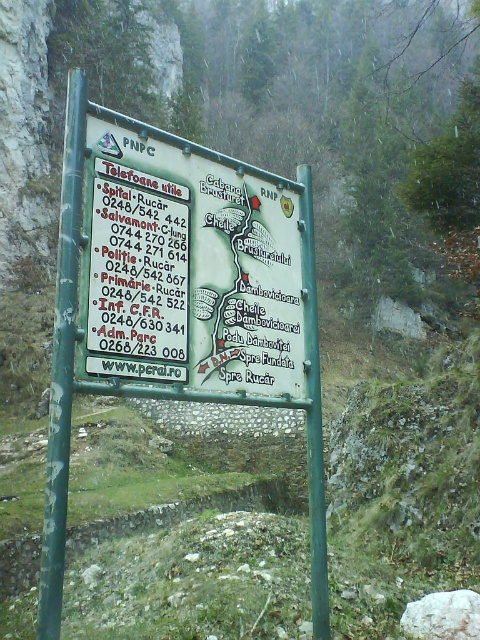
Between green metal sign at center and green painted metal pole at left, which one is positioned higher?

green metal sign at center is above.

Locate an element on the screen. The width and height of the screenshot is (480, 640). green metal sign at center is located at coordinates (190, 317).

Is point (190, 188) farther from viewer compared to point (64, 337)?

Yes, point (190, 188) is behind point (64, 337).

Where is `green metal sign at center`? This screenshot has height=640, width=480. green metal sign at center is located at coordinates (190, 317).

Does point (57, 333) come closer to viewer compared to point (310, 552)?

Yes, point (57, 333) is closer to viewer.

Does green painted metal pole at left appear under green metallic pole at center?

Actually, green painted metal pole at left is above green metallic pole at center.

In the scene shown: Who is more forward, (73, 172) or (300, 264)?

Point (73, 172) is in front.

Identify the location of green painted metal pole at left. Image resolution: width=480 pixels, height=640 pixels. (62, 362).

Looking at this image, is green metal sign at center positioned at the back of green metallic pole at center?

No, it is in front of green metallic pole at center.

Who is positioned more to the right, green metal sign at center or green metallic pole at center?

From the viewer's perspective, green metallic pole at center appears more on the right side.

Who is more forward, [62,385] or [308,272]?

Point [62,385] is more forward.

Find the location of `green metal sign at center`. green metal sign at center is located at coordinates (190, 317).